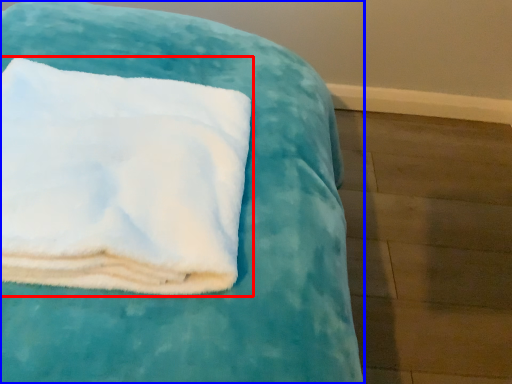
Question: Which object appears farthest to the camera in this image, towel (highlighted by a red box) or furniture (highlighted by a blue box)?

Choices:
 (A) towel
 (B) furniture

Answer: (B)